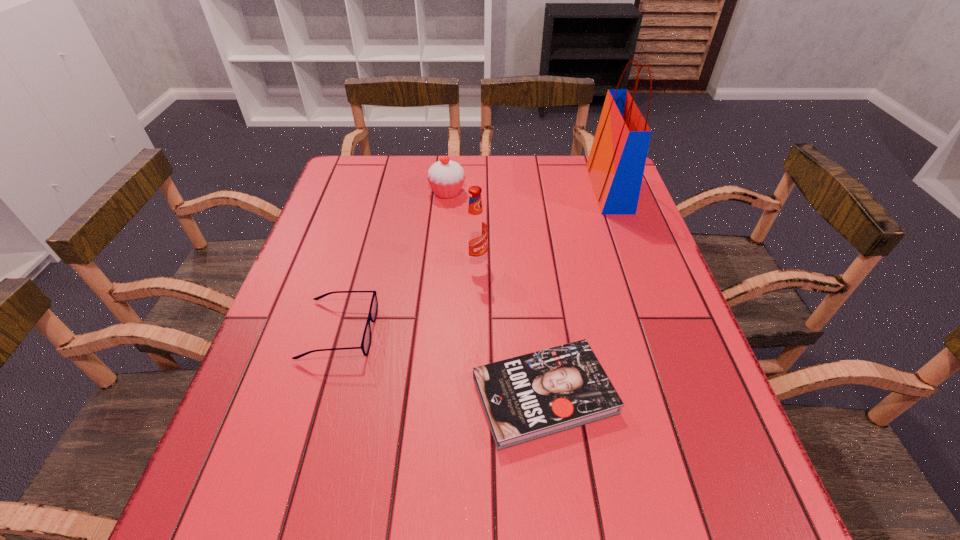
Locate an element on the screen. vacant region at the far edge of the desktop is located at coordinates (475, 178).

Where is `blank space at the left edge of the desktop`? The width and height of the screenshot is (960, 540). blank space at the left edge of the desktop is located at coordinates (336, 270).

Locate an element on the screen. Image resolution: width=960 pixels, height=540 pixels. vacant space at the right edge of the desktop is located at coordinates (623, 239).

Locate an element on the screen. This screenshot has height=540, width=960. free point between the third tallest object and the fourth tallest object is located at coordinates (394, 261).

Find the location of a particular element. free spot between the rightmost object and the book is located at coordinates (577, 292).

Locate an element on the screen. vacant area between the fourth shortest object and the cupcake is located at coordinates (462, 227).

I want to click on empty space that is in between the cupcake and the book, so click(495, 294).

Locate an element on the screen. free area in between the shortest object and the spectacles is located at coordinates (442, 363).

I want to click on free area in between the third nearest object and the book, so point(510,328).

Locate an element on the screen. vacant space in between the shortest object and the spectacles is located at coordinates (442, 363).